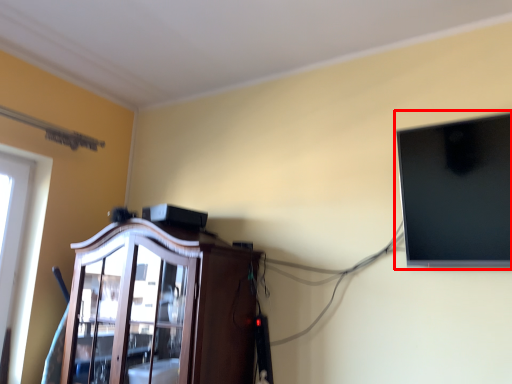
Question: Observing the image, what is the correct spatial positioning of computer monitor (annotated by the red box) in reference to cabinetry?

Choices:
 (A) left
 (B) right

Answer: (B)